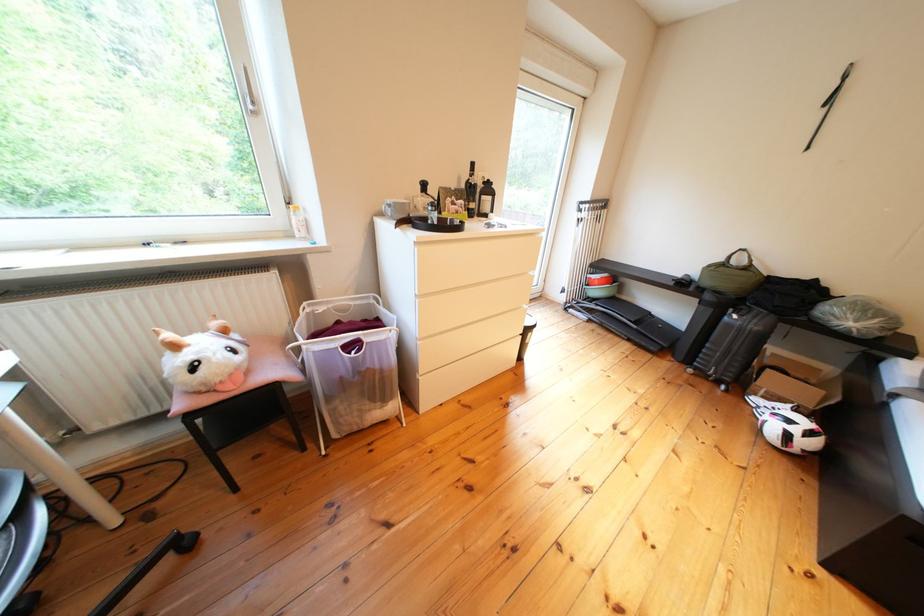
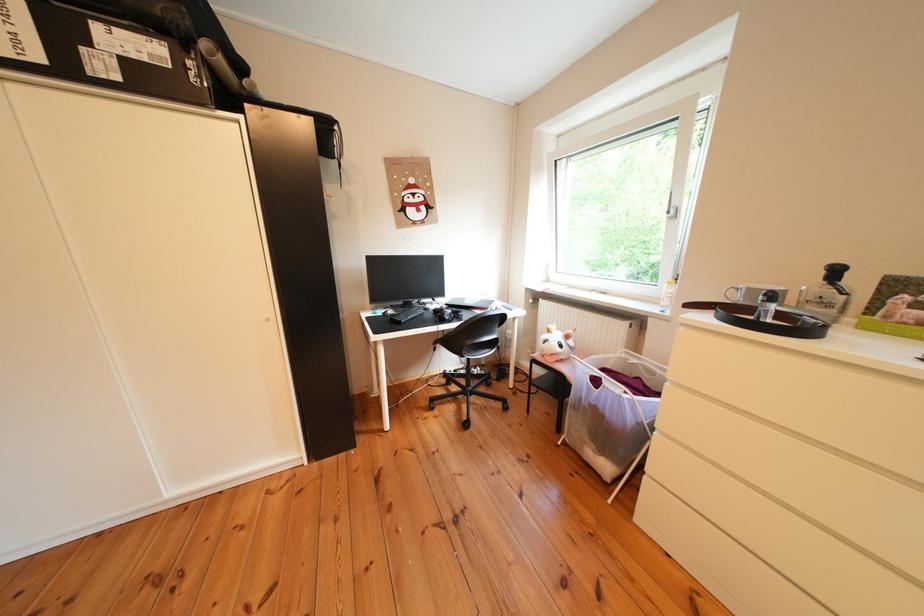
In the second image, find the point that corresponds to (x=404, y=209) in the first image.

(751, 294)